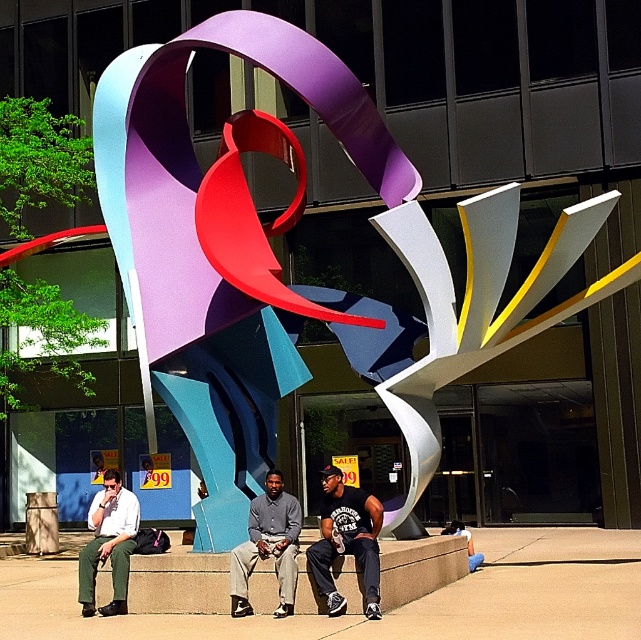
You are standing in front of the sculpture and want to take a photo of the matte metallic abstract sculpture at center. If your camera has a maximum focus range of 30 feet, will it be able to focus on the sculpture?

The matte metallic abstract sculpture at center is 31.56 feet from viewer, which exceeds the camera maximum focus range of 30 feet. Therefore, the camera cannot focus on the sculpture.

You are standing in front of the sculpture and want to take a photo of the matte metallic abstract sculpture at center and the matte white shirt at left. Which object should you focus on first if you want to capture both in the same frame without moving your camera?

You should focus on the matte metallic abstract sculpture at center first because it is positioned on the right side of the matte white shirt at left, meaning it is further to the right and closer to the edge of the frame. By starting with the sculpture, you can ensure both objects are included without needing to adjust the camera position.